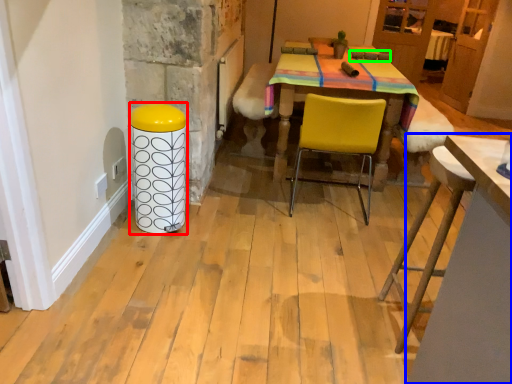
Question: Which object is the farthest from bar stool (highlighted by a red box)? Choose among these: table (highlighted by a blue box) or armchair (highlighted by a green box).

Choices:
 (A) table
 (B) armchair

Answer: (B)